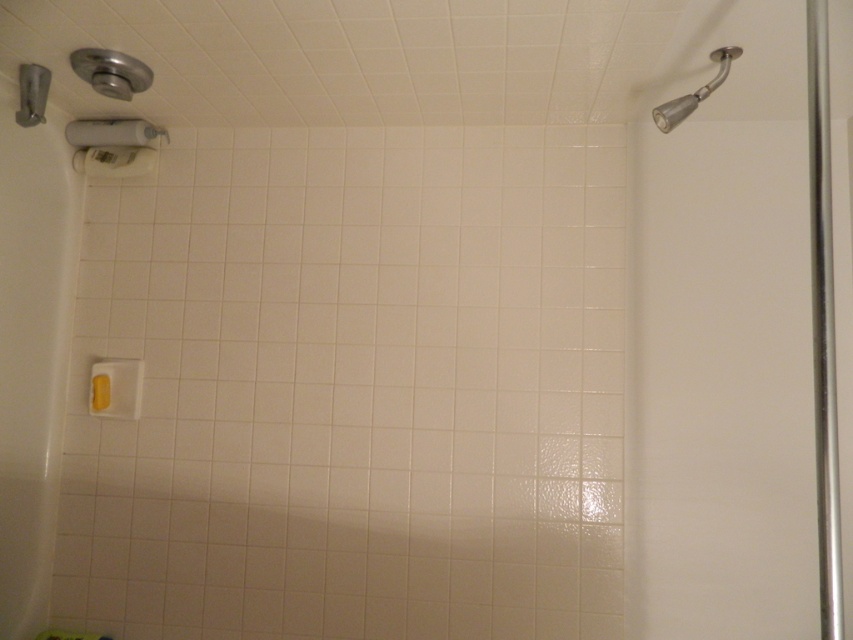
You are standing in the shower area and want to reach the point marked as point (763, 150). Given that your arm can extend 1.5 meters, can you reach it?

The point (763, 150) is 1.61 meters away from the camera, which is slightly beyond your arm extension of 1.5 meters. Therefore, you cannot reach it.

You are designing a layout for a bathroom renovation and need to ensure proper placement of fixtures. Given the current setup, where is the silver metallic shower door at right positioned relative to the matte gray showerhead at upper left?

The silver metallic shower door at right is located below the matte gray showerhead at upper left.